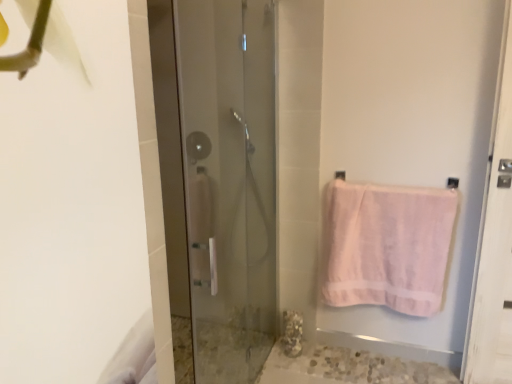
Question: Considering the relative positions of transparent glass shower door at center and pink cotton towel at right in the image provided, is transparent glass shower door at center to the left or to the right of pink cotton towel at right?

Choices:
 (A) right
 (B) left

Answer: (B)

Question: Is transparent glass shower door at center in front of or behind pink cotton towel at right in the image?

Choices:
 (A) front
 (B) behind

Answer: (A)

Question: Which object is the closest to the clear glass shower at center?

Choices:
 (A) transparent glass shower door at center
 (B) pink cotton towel at right

Answer: (A)

Question: Which object is the farthest from the clear glass shower at center?

Choices:
 (A) transparent glass shower door at center
 (B) pink cotton towel at right

Answer: (B)